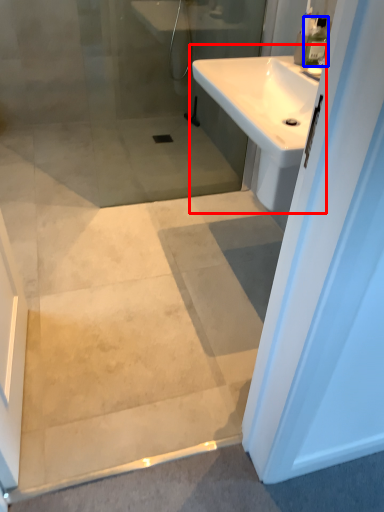
Question: Which point is closer to the camera, sink (highlighted by a red box) or toiletry (highlighted by a blue box)?

Choices:
 (A) sink
 (B) toiletry

Answer: (A)